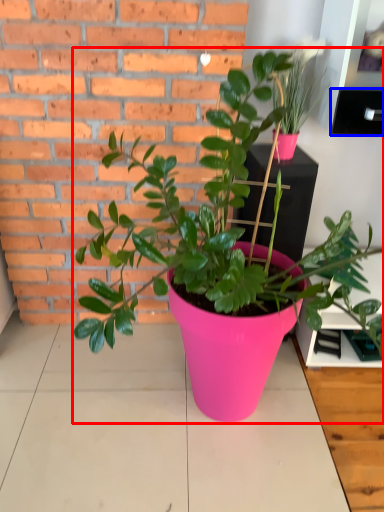
Question: Which object appears closest to the camera in this image, houseplant (highlighted by a red box) or shelf (highlighted by a blue box)?

Choices:
 (A) houseplant
 (B) shelf

Answer: (A)